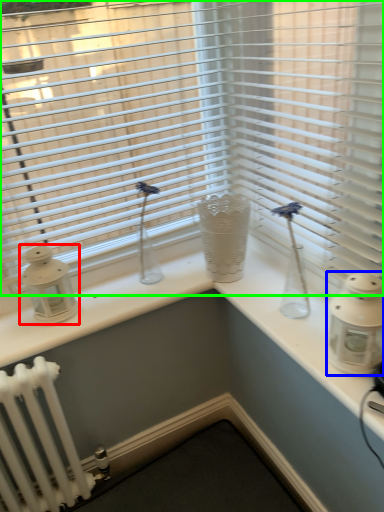
Question: Based on their relative distances, which object is farther from candle holder (highlighted by a red box)? Choose from candle holder (highlighted by a blue box) and window blind (highlighted by a green box).

Choices:
 (A) candle holder
 (B) window blind

Answer: (A)